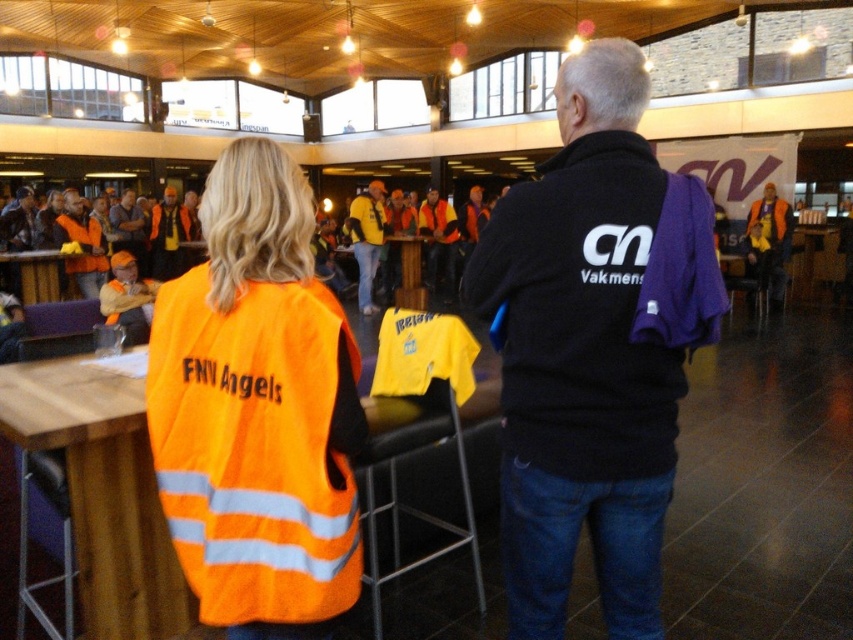
Is the position of wooden table at left less distant than that of wooden table at center?

Yes, it is in front of wooden table at center.

From the picture: Is the position of wooden table at left more distant than that of wooden table at center?

No, wooden table at left is in front of wooden table at center.

Between point (36, 300) and point (410, 260), which one is positioned in front?

Point (36, 300) is more forward.

I want to click on wooden table at left, so click(36, 275).

Is the position of black fleece jacket at center more distant than that of yellow fabric shirt at center?

No.

Find the location of a particular element. This screenshot has height=640, width=853. black fleece jacket at center is located at coordinates (593, 348).

At what (x,y) coordinates should I click in order to perform the action: click on black fleece jacket at center. Please return your answer as a coordinate pair (x, y). Looking at the image, I should click on (593, 348).

Does black fleece jacket at center appear on the left side of wooden table at left?

Incorrect, black fleece jacket at center is not on the left side of wooden table at left.

This screenshot has width=853, height=640. I want to click on black fleece jacket at center, so click(x=593, y=348).

Is point (668, 289) positioned before point (30, 272)?

Yes, point (668, 289) is closer to viewer.

Identify the location of black fleece jacket at center. This screenshot has width=853, height=640. (593, 348).